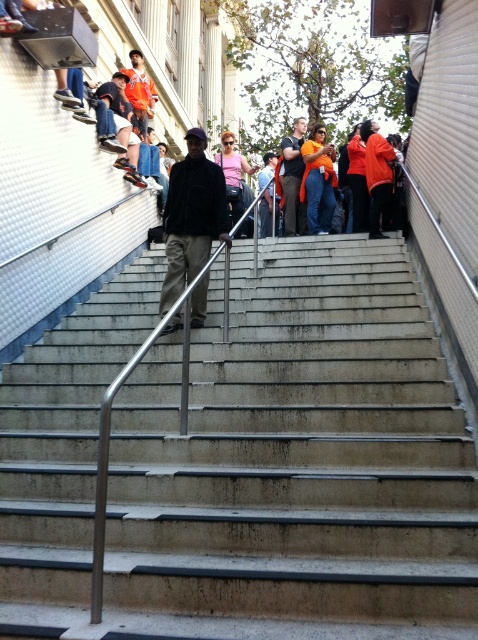
You are a photographer trying to capture a photo of the dark brown leather jacket at center and the orange fabric shirt at upper center. Which of the two objects would require you to zoom in more to get a clear shot?

The orange fabric shirt at upper center would require more zooming in because it is smaller in size compared to the dark brown leather jacket at center.

You are a photographer trying to capture a wide shot of the scene. You notice the dark brown leather jacket at center and the orange fabric shirt at upper center. Which object should you focus on first to ensure both are in frame, considering their sizes?

The dark brown leather jacket at center is wider than the orange fabric shirt at upper center, so focusing on the dark brown leather jacket at center first will help ensure both are in frame due to its larger size.